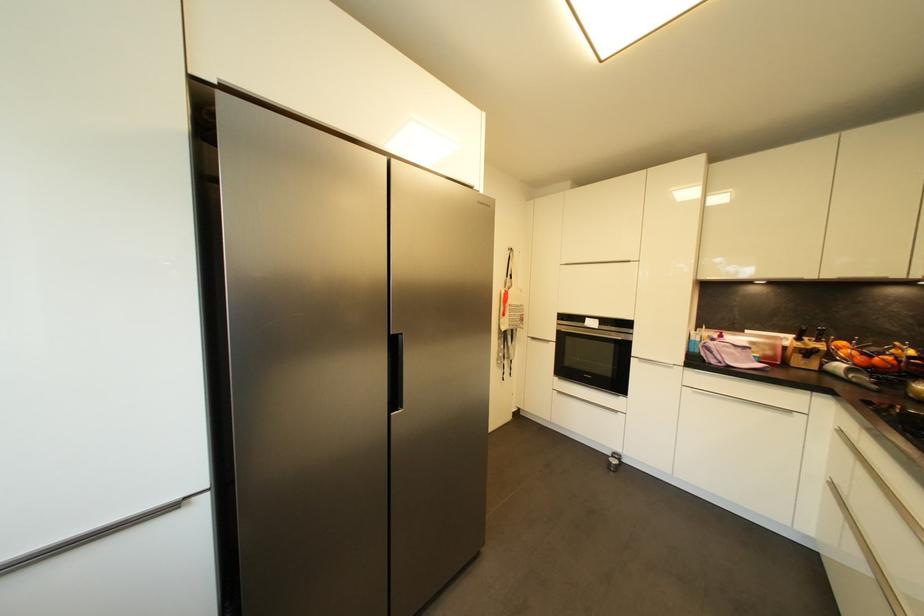
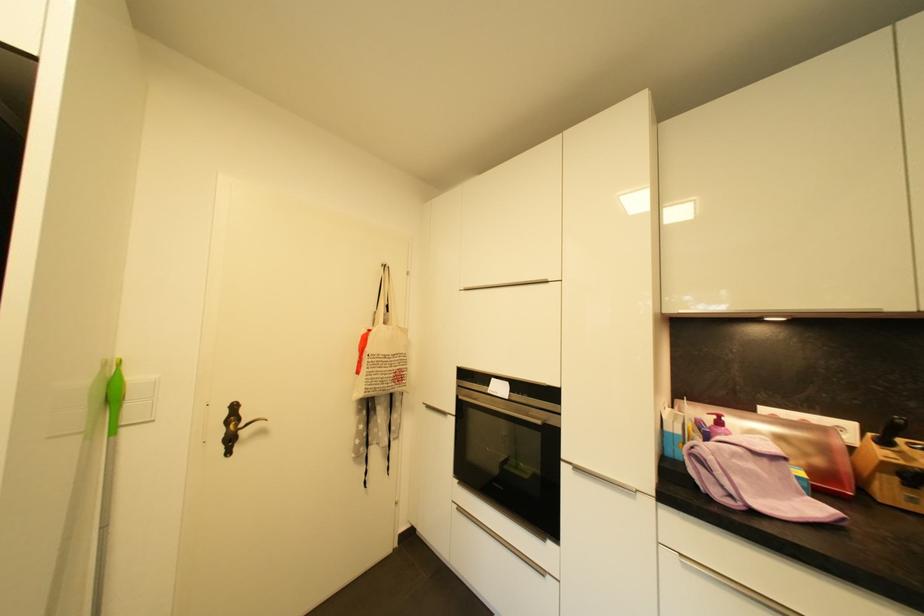
Find the pixel in the second image that matches (564,394) in the first image.

(465, 511)